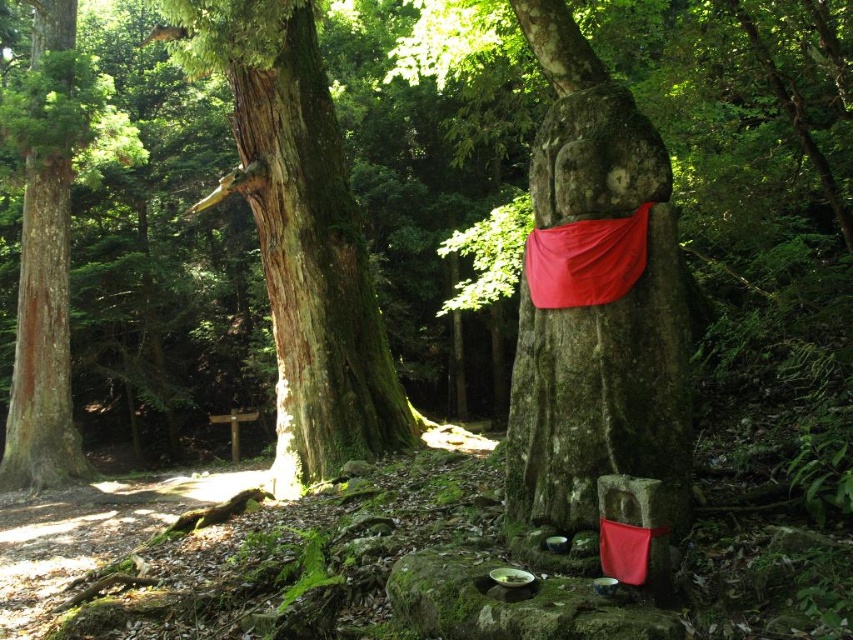
Question: Which point appears closest to the camera in this image?

Choices:
 (A) tap(270, 221)
 (B) tap(593, 356)
 (C) tap(65, 259)
 (D) tap(601, 294)

Answer: (D)

Question: Can you confirm if green mossy stone statue at center is thinner than red fabric at center?

Choices:
 (A) yes
 (B) no

Answer: (B)

Question: Is green mossy stone statue at center further to the viewer compared to smooth reddish-brown tree trunk at left?

Choices:
 (A) no
 (B) yes

Answer: (A)

Question: Is green mossy stone statue at center bigger than smooth reddish-brown tree trunk at left?

Choices:
 (A) yes
 (B) no

Answer: (B)

Question: Which point is farther from the camera taking this photo?

Choices:
 (A) (627, 289)
 (B) (550, 6)
 (C) (62, 292)

Answer: (C)

Question: Which point appears farthest from the camera in this image?

Choices:
 (A) (614, 243)
 (B) (368, 300)
 (C) (64, 113)
 (D) (543, 58)

Answer: (C)